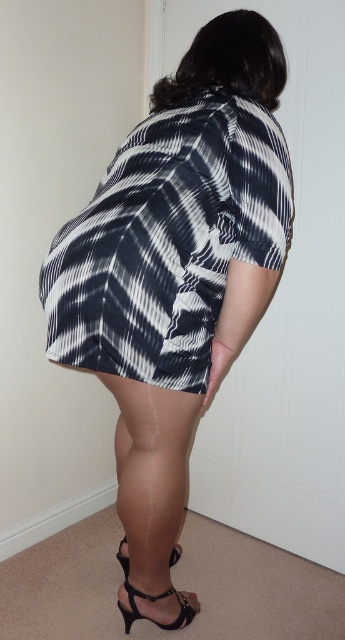
Is point (279, 268) in front of point (209, 307)?

Yes, it is.

Does printed fabric dress at center appear on the right side of black and white striped dress at center?

In fact, printed fabric dress at center is to the left of black and white striped dress at center.

Who is more forward, (221, 236) or (168, 333)?

Point (168, 333) is in front.

Find the location of a particular element. This screenshot has width=345, height=640. printed fabric dress at center is located at coordinates (175, 268).

Is the position of satin black high heels at lower center more distant than that of black leather sandal at lower center?

No, satin black high heels at lower center is in front of black leather sandal at lower center.

Can you confirm if satin black high heels at lower center is taller than black leather sandal at lower center?

Indeed, satin black high heels at lower center has a greater height compared to black leather sandal at lower center.

Between point (140, 410) and point (123, 566), which one is positioned behind?

The point (123, 566) is more distant.

Locate an element on the screen. satin black high heels at lower center is located at coordinates (152, 493).

Does black and white striped dress at center come in front of black leather sandal at lower center?

Yes, black and white striped dress at center is closer to the viewer.

Is point (46, 346) behind point (172, 561)?

That is False.

The width and height of the screenshot is (345, 640). I want to click on black and white striped dress at center, so click(x=168, y=241).